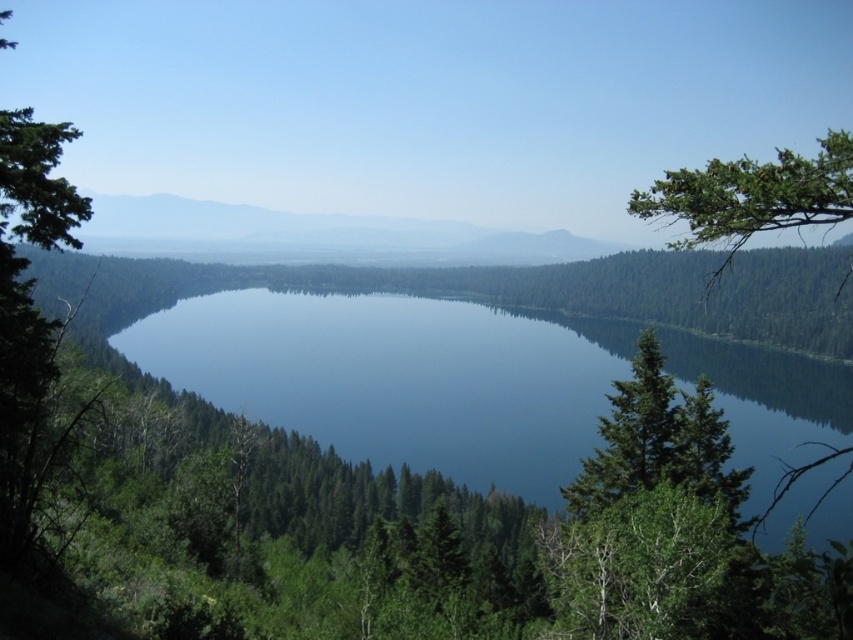
Question: Which point appears farthest from the camera in this image?

Choices:
 (A) (218, 376)
 (B) (180, 253)

Answer: (B)

Question: Which object is positioned farthest from the blue reflective water at center?

Choices:
 (A) green matte tree at right
 (B) smooth gray mountain at center

Answer: (B)

Question: Among these objects, which one is nearest to the camera?

Choices:
 (A) green matte tree at right
 (B) smooth gray mountain at center
 (C) blue reflective water at center

Answer: (A)

Question: Is smooth gray mountain at center to the left of green matte tree at right from the viewer's perspective?

Choices:
 (A) yes
 (B) no

Answer: (A)

Question: Is blue reflective water at center above smooth gray mountain at center?

Choices:
 (A) no
 (B) yes

Answer: (A)

Question: Does blue reflective water at center have a larger size compared to smooth gray mountain at center?

Choices:
 (A) no
 (B) yes

Answer: (A)